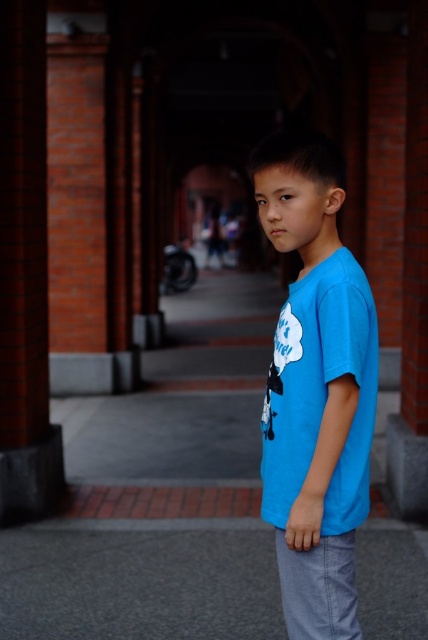
You are a photographer trying to capture the boy in the image. You want to place a focus point at the center of the image to highlight his blue cotton shirt. Is the point at coordinates point [315,388] on the blue cotton shirt at center?

Yes, the point [315,388] is on the blue cotton shirt at center, so placing the focus point there will highlight the shirt effectively.

You are a photographer trying to capture the boy in the image. You want to ensure the blue cotton shirt at center and the gray asphalt pavement at lower center are both in focus. The camera you are using has a depth of field that can cover 2 meters. Will both objects be in focus?

The blue cotton shirt at center is 2.01 meters away from the gray asphalt pavement at lower center. Since the distance between them is slightly over 2 meters, the camera might not be able to keep both in focus simultaneously.

You are a fashion designer observing the scene. You need to decide whether the blue cotton shirt at center can be displayed on a mannequin standing on the gray asphalt pavement at lower center. The mannequin requires at least 1.2 meters of space in front of it. Is there enough space?

The blue cotton shirt at center is narrower than the gray asphalt pavement at lower center. Since the shirt is narrower, the gray asphalt pavement at lower center has sufficient width to accommodate the mannequin with the required 1.2 meters of space in front of it.